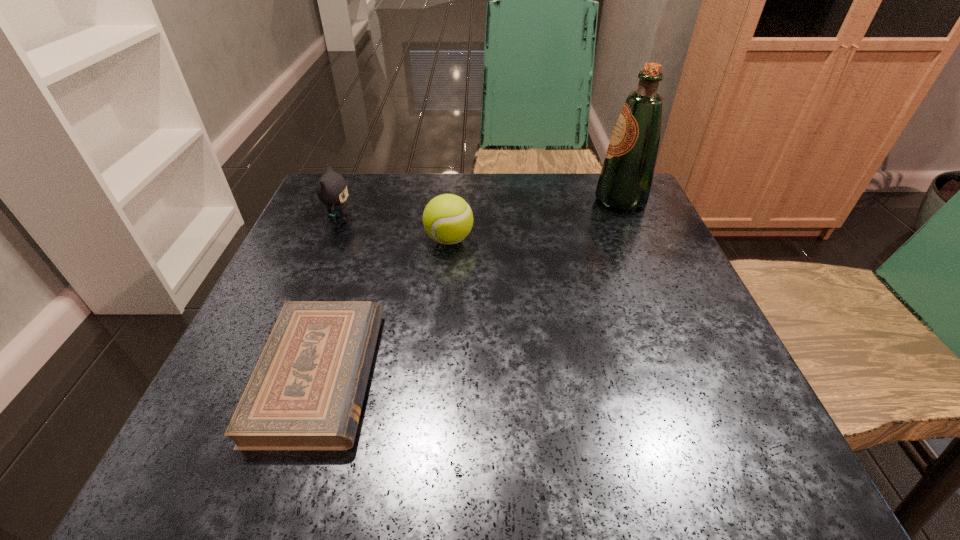
Where is `object present at the near left corner`? object present at the near left corner is located at coordinates (306, 392).

Find the location of `object that is positioned at the far right corner`. object that is positioned at the far right corner is located at coordinates (626, 177).

This screenshot has width=960, height=540. Identify the location of free space at the far edge of the desktop. (448, 179).

The width and height of the screenshot is (960, 540). In the image, there is a desktop. Identify the location of blank space at the near edge. (506, 434).

This screenshot has height=540, width=960. I want to click on free space at the left edge of the desktop, so click(349, 234).

Find the location of a particular element. vacant space at the right edge of the desktop is located at coordinates (668, 348).

Where is `free spot at the far left corner of the desktop`? This screenshot has width=960, height=540. free spot at the far left corner of the desktop is located at coordinates (372, 207).

Where is `blank area at the far right corner`? This screenshot has height=540, width=960. blank area at the far right corner is located at coordinates (660, 225).

Identify the location of free space at the near right corner of the desktop. This screenshot has height=540, width=960. (747, 418).

The height and width of the screenshot is (540, 960). I want to click on unoccupied position between the olive oil and the tennis ball, so click(x=535, y=220).